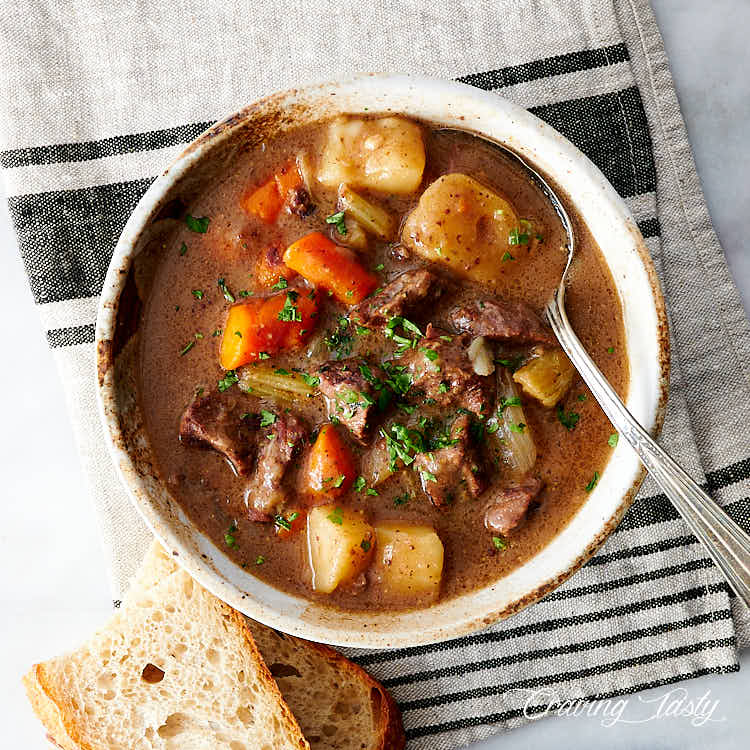
Locate an element on the screen. This screenshot has width=750, height=750. table is located at coordinates (716, 73).